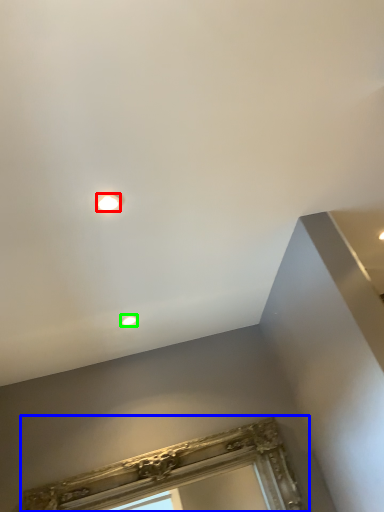
Question: Based on their relative distances, which object is nearer to droplight (highlighted by a red box)? Choose from window frame (highlighted by a blue box) and droplight (highlighted by a green box).

Choices:
 (A) window frame
 (B) droplight

Answer: (B)